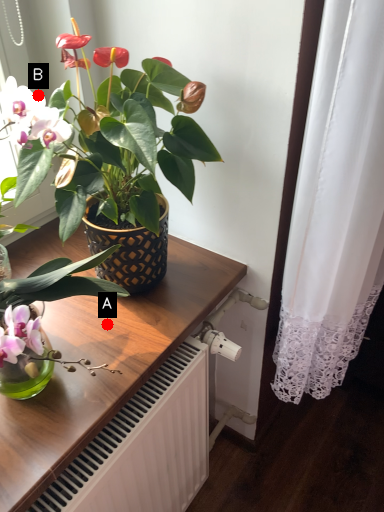
Question: Two points are circled on the image, labeled by A and B beside each circle. Among these points, which one is farthest from the camera?

Choices:
 (A) A is further
 (B) B is further

Answer: (B)